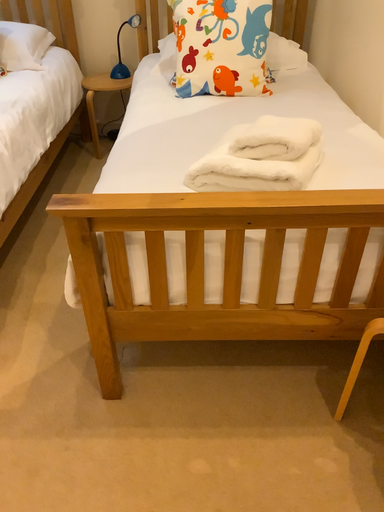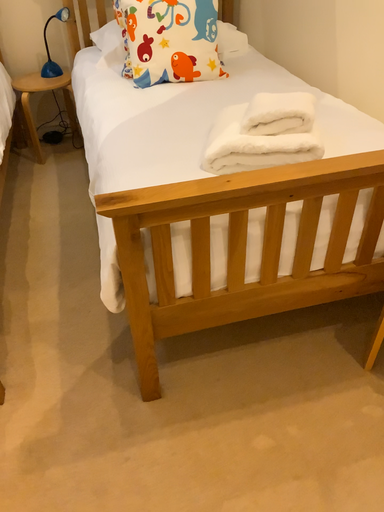
Question: Which way did the camera rotate in the video?

Choices:
 (A) rotated right
 (B) rotated left

Answer: (A)